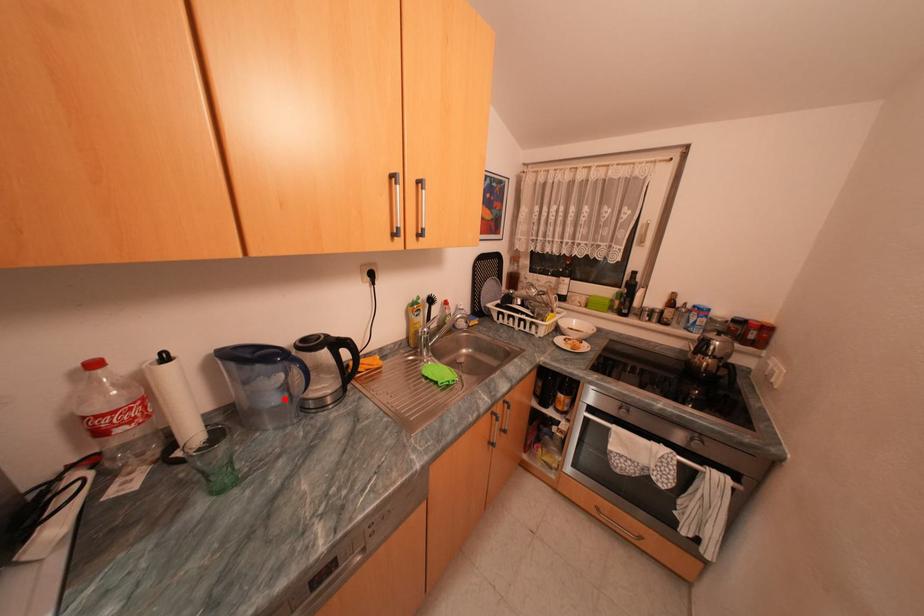
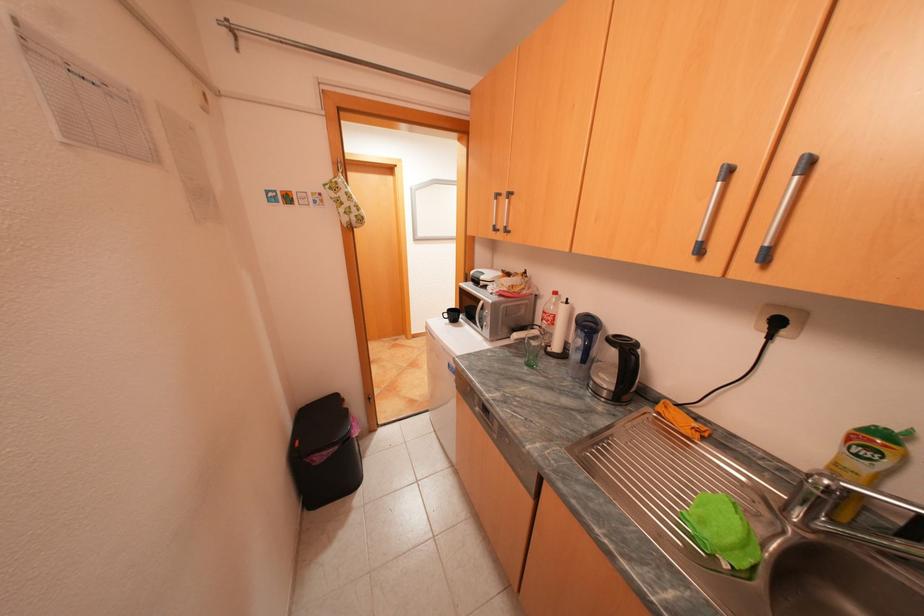
Where in the second image is the point corresponding to the highlighted location from the first image?

(586, 355)